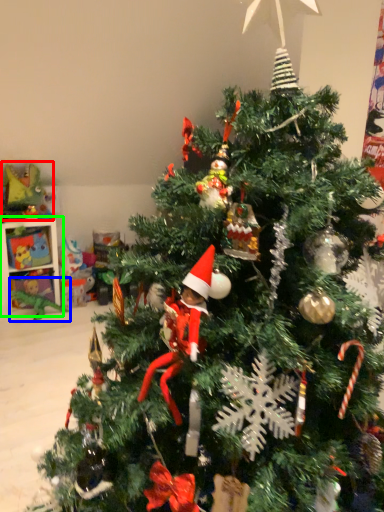
Question: Based on their relative distances, which object is farther from toy (highlighted by a red box)? Choose from toy (highlighted by a blue box) and shelf (highlighted by a green box).

Choices:
 (A) toy
 (B) shelf

Answer: (A)